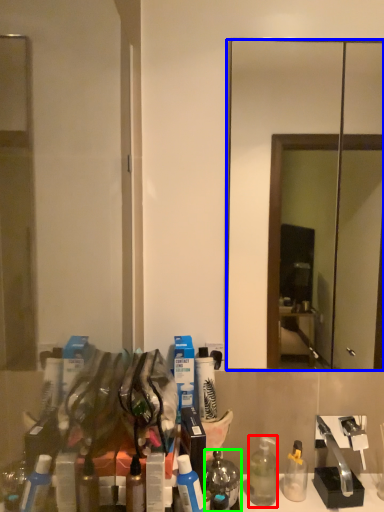
Question: Which is nearer to the bottle (highlighted by a red box)? mirror (highlighted by a blue box) or mouthwash (highlighted by a green box).

Choices:
 (A) mirror
 (B) mouthwash

Answer: (B)